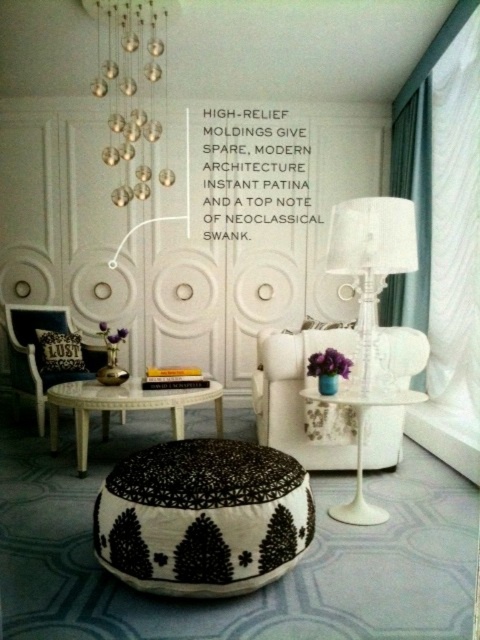
You are planning to rearrange the living room and want to place a new rectangular side table between the black printed fabric ottoman at center and the clear glass chandelier at upper center. Considering their sizes, which object should the table be closer to?

The black printed fabric ottoman at center occupies less space than the clear glass chandelier at upper center, so the table should be placed closer to the clear glass chandelier at upper center to accommodate its larger size.

You are a guest in this room and want to place a small decorative item on the clear glass chandelier at upper center. Is the black printed fabric ottoman at center in a position that would make it easy to reach the chandelier?

The black printed fabric ottoman at center is below the clear glass chandelier at upper center, so it is positioned directly underneath it. This means you can easily step onto the ottoman to reach the chandelier for placing the decorative item.

Where is the black printed fabric ottoman at center located in the room?

The black printed fabric ottoman at center is located at point [203,516] in the room.